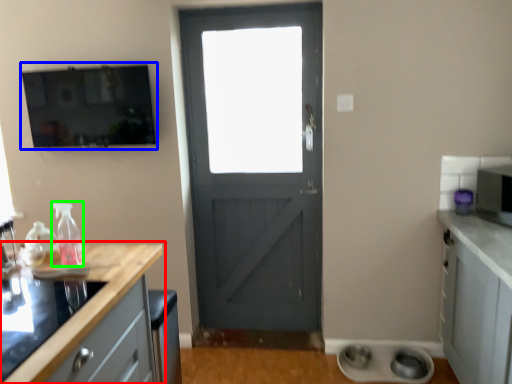
Question: Considering the real-world distances, which object is farthest from countertop (highlighted by a red box)? window screen (highlighted by a blue box) or bottle (highlighted by a green box)?

Choices:
 (A) window screen
 (B) bottle

Answer: (A)